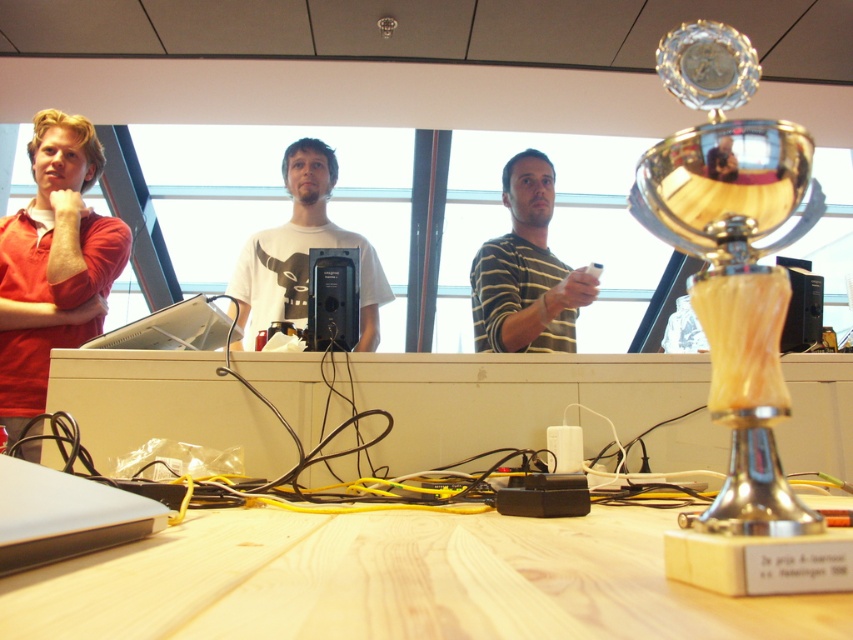
Question: Considering the relative positions of matte red shirt at left and white plastic laptop at center in the image provided, where is matte red shirt at left located with respect to white plastic laptop at center?

Choices:
 (A) above
 (B) below

Answer: (A)

Question: Which object appears closest to the camera in this image?

Choices:
 (A) gold polished trophy at right
 (B) light wood table at center
 (C) matte red shirt at left

Answer: (B)

Question: Can you confirm if matte red shirt at left is positioned below white plastic laptop at center?

Choices:
 (A) no
 (B) yes

Answer: (A)

Question: Does light wood table at center have a greater width compared to white plastic laptop at center?

Choices:
 (A) no
 (B) yes

Answer: (B)

Question: Among these objects, which one is farthest from the camera?

Choices:
 (A) white plastic laptop at center
 (B) white matte t-shirt at center
 (C) silver metallic laptop at lower left
 (D) light wood table at center

Answer: (B)

Question: Among these objects, which one is nearest to the camera?

Choices:
 (A) white plastic laptop at center
 (B) matte red shirt at left
 (C) silver metallic laptop at lower left

Answer: (C)